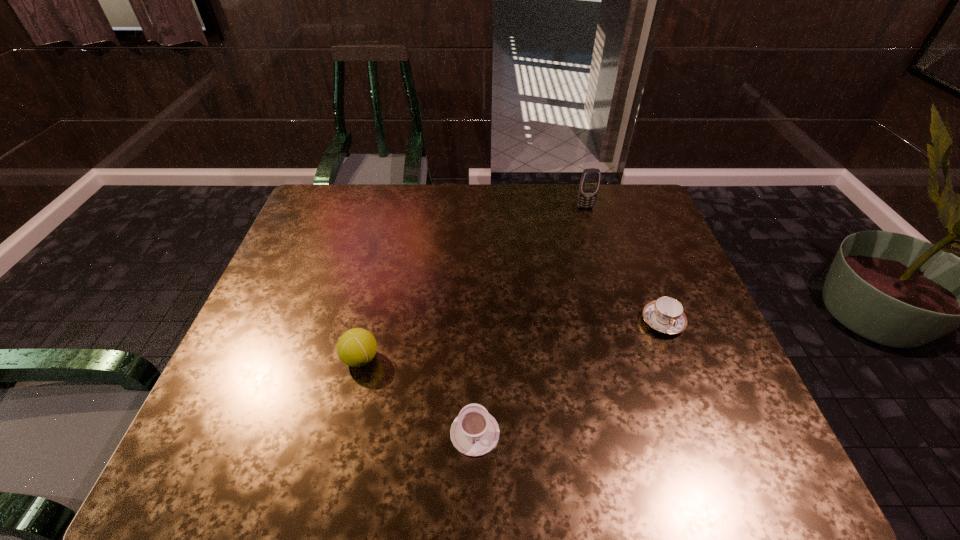
At what (x,y) coordinates should I click in order to perform the action: click on the farthest object. Please return your answer as a coordinate pair (x, y). This screenshot has width=960, height=540. Looking at the image, I should click on (590, 180).

This screenshot has width=960, height=540. What are the coordinates of `the tallest object` in the screenshot? It's located at coord(590,180).

Where is `the third farthest object`? This screenshot has width=960, height=540. the third farthest object is located at coordinates (356, 347).

The height and width of the screenshot is (540, 960). In order to click on the third shortest object in this screenshot , I will do `click(356, 347)`.

Find the location of a particular element. This screenshot has height=540, width=960. the farther teacup is located at coordinates (666, 314).

The image size is (960, 540). I want to click on the rightmost object, so click(x=666, y=314).

Identify the location of the nearest object. Image resolution: width=960 pixels, height=540 pixels. (474, 432).

This screenshot has height=540, width=960. Identify the location of the second object from left to right. (474, 432).

This screenshot has height=540, width=960. I want to click on blank space located 0.200m on the front face of the second object from right to left, so click(598, 249).

In order to click on vacant space located on the back of the third shortest object in this screenshot , I will do `click(383, 265)`.